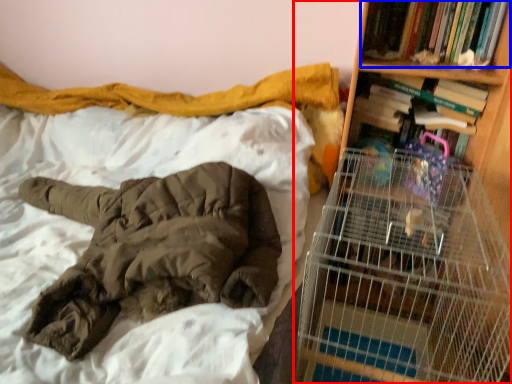
Question: Which point is closer to the camera, bookcase (highlighted by a red box) or book (highlighted by a blue box)?

Choices:
 (A) bookcase
 (B) book

Answer: (A)